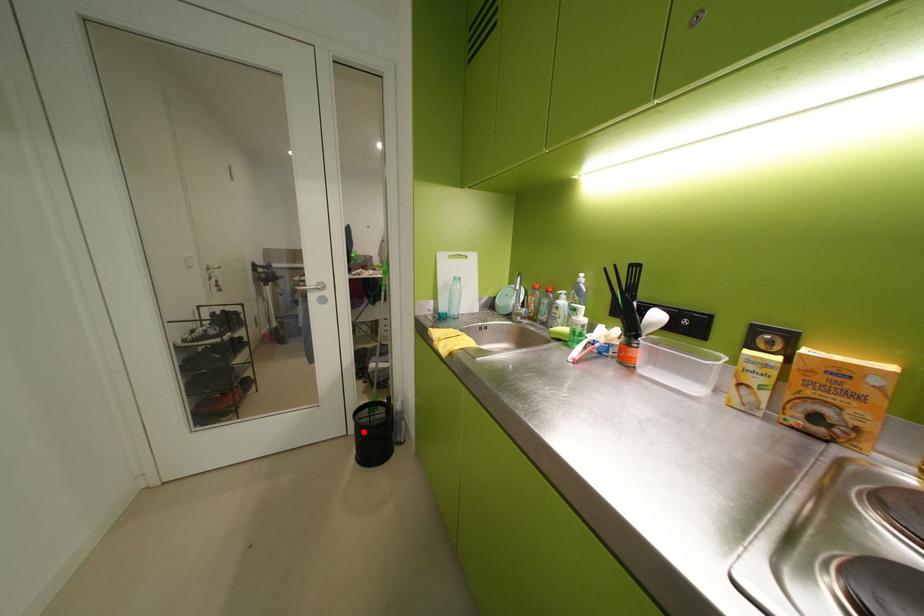
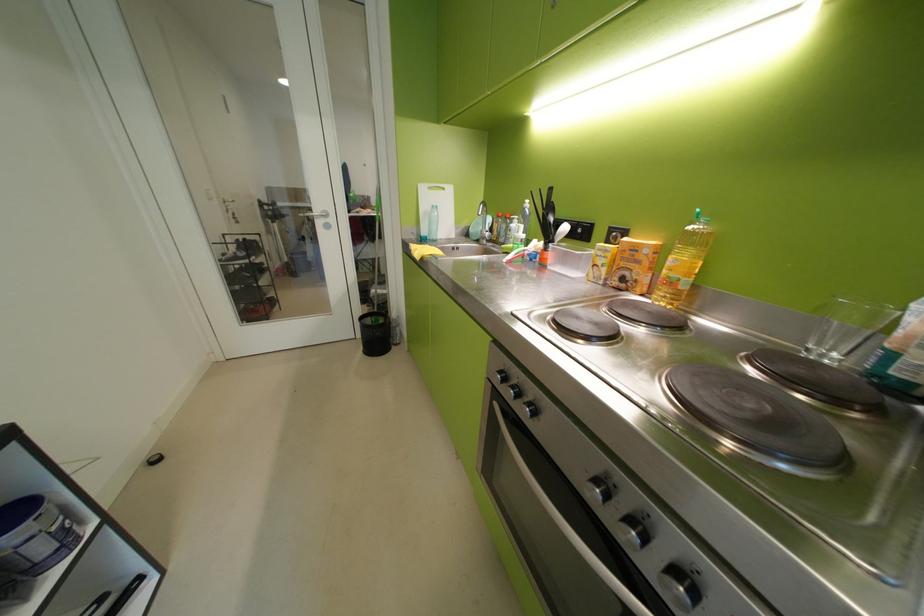
In the second image, find the point that corresponds to the highlighted location in the first image.

(370, 336)